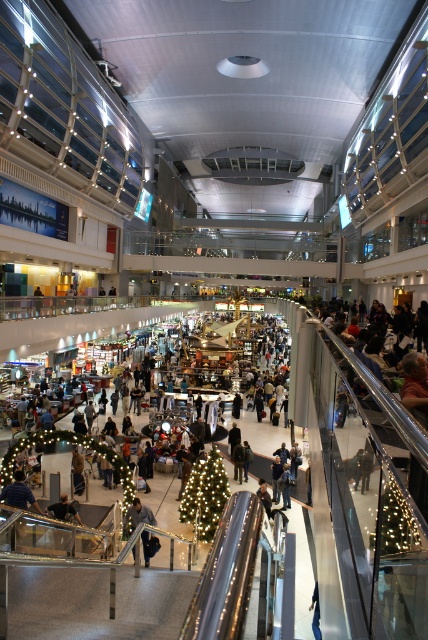
Question: Can you confirm if illuminated plastic christmas tree at center is wider than dark gray jacket at center?

Choices:
 (A) no
 (B) yes

Answer: (A)

Question: Among these points, which one is farthest from the camera?

Choices:
 (A) (213, 480)
 (B) (131, 518)

Answer: (A)

Question: Among these objects, which one is farthest from the camera?

Choices:
 (A) dark gray jacket at center
 (B) illuminated plastic christmas tree at center

Answer: (A)

Question: Which point is farther to the camera?

Choices:
 (A) (208, 461)
 (B) (133, 506)

Answer: (A)

Question: Can you confirm if illuminated plastic christmas tree at center is smaller than dark gray jacket at center?

Choices:
 (A) no
 (B) yes

Answer: (B)

Question: Where is illuminated plastic christmas tree at center located in relation to dark gray jacket at center in the image?

Choices:
 (A) right
 (B) left

Answer: (A)